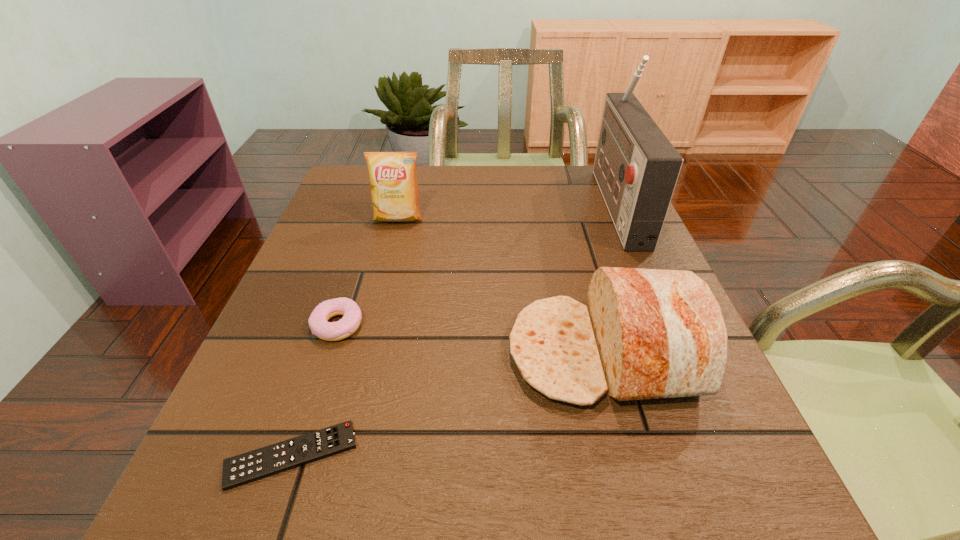
Locate an element on the screen. vacant space situated at the sliced end of the bread is located at coordinates (307, 353).

The image size is (960, 540). Find the location of `blank space located 0.390m at the sliced end of the bread`. blank space located 0.390m at the sliced end of the bread is located at coordinates (285, 353).

You are a GUI agent. You are given a task and a screenshot of the screen. Output one action in this format:
    pyautogui.click(x=<x>, y=<y>)
    Task: Click on the vacant space situated at the sliced end of the bread
    The width and height of the screenshot is (960, 540).
    Given the screenshot: What is the action you would take?
    pyautogui.click(x=324, y=353)

Where is `vacant area located 0.170m on the back of the fourth tallest object`? Image resolution: width=960 pixels, height=540 pixels. vacant area located 0.170m on the back of the fourth tallest object is located at coordinates (362, 253).

Find the location of a particular element. This screenshot has height=540, width=960. free space located on the right of the shortest object is located at coordinates (531, 455).

The width and height of the screenshot is (960, 540). Identify the location of radio receiver located at the far edge. (636, 167).

You are a GUI agent. You are given a task and a screenshot of the screen. Output one action in this format:
    pyautogui.click(x=<x>, y=<y>)
    Task: Click on the crisp (potato chip) positioned at the far edge
    
    Given the screenshot: What is the action you would take?
    pyautogui.click(x=394, y=190)

The image size is (960, 540). In order to click on object positioned at the near edge in this screenshot , I will do `click(251, 466)`.

At what (x,y) coordinates should I click in order to perform the action: click on crisp (potato chip) at the left edge. Please return your answer as a coordinate pair (x, y). The height and width of the screenshot is (540, 960). Looking at the image, I should click on (394, 190).

Identify the location of doughnut at the left edge. The width and height of the screenshot is (960, 540). (330, 331).